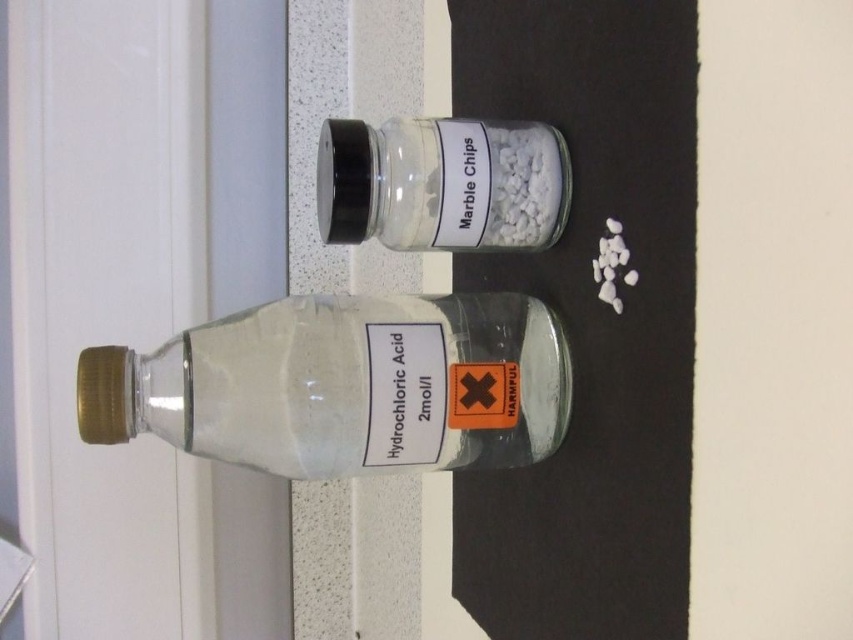
Question: Which object is the farthest from the transparent glass jar of marble chips at center?

Choices:
 (A) transparent glass bottle at center
 (B) transparent glass door at left

Answer: (B)

Question: Which is nearer to the transparent glass jar of marble chips at center?

Choices:
 (A) transparent glass door at left
 (B) transparent glass bottle at center

Answer: (B)

Question: Is transparent glass door at left thinner than transparent glass jar of marble chips at center?

Choices:
 (A) no
 (B) yes

Answer: (A)

Question: Which of these objects is positioned farthest from the transparent glass bottle at center?

Choices:
 (A) transparent glass door at left
 (B) transparent glass jar of marble chips at center

Answer: (A)

Question: Is transparent glass door at left thinner than transparent glass bottle at center?

Choices:
 (A) no
 (B) yes

Answer: (B)

Question: Can you confirm if transparent glass door at left is smaller than transparent glass jar of marble chips at center?

Choices:
 (A) yes
 (B) no

Answer: (B)